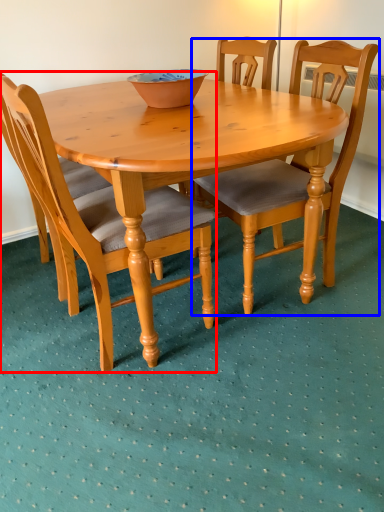
Question: Among these objects, which one is nearest to the camera, chair (highlighted by a red box) or chair (highlighted by a blue box)?

Choices:
 (A) chair
 (B) chair

Answer: (A)